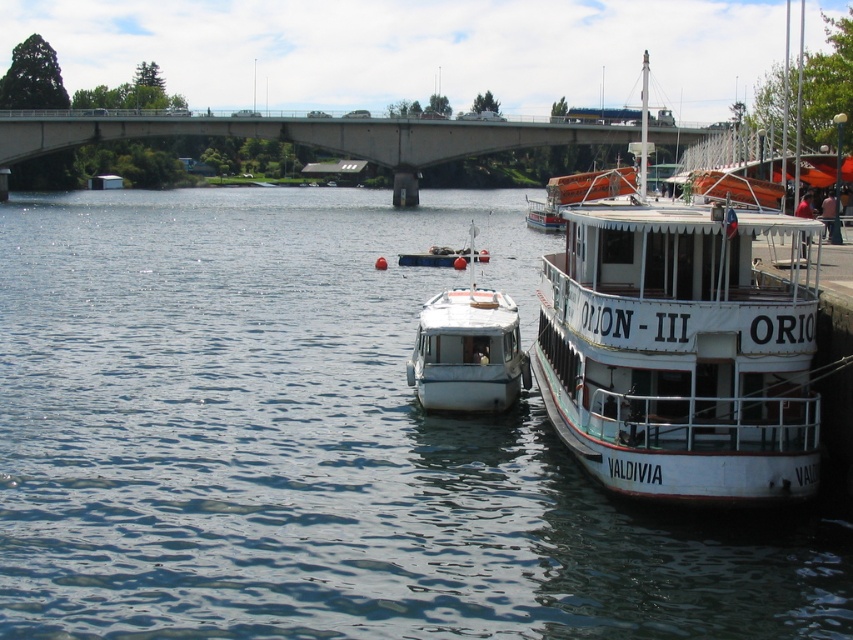
Does point (403, 204) lie behind point (463, 323)?

Yes, it is.

Is concrete bridge at upper center closer to the viewer compared to white glossy boat at center?

No, concrete bridge at upper center is further to the viewer.

Which is behind, point (432, 161) or point (477, 333)?

The point (432, 161) is more distant.

This screenshot has height=640, width=853. In order to click on concrete bridge at upper center in this screenshot , I will do `click(305, 134)`.

Can you confirm if white wooden boat at right is positioned below concrete bridge at upper center?

Yes, white wooden boat at right is below concrete bridge at upper center.

Is the position of white wooden boat at right more distant than that of concrete bridge at upper center?

No, white wooden boat at right is closer to the viewer.

Is point (595, 324) in front of point (457, 134)?

Yes, point (595, 324) is in front of point (457, 134).

You are a GUI agent. You are given a task and a screenshot of the screen. Output one action in this format:
    pyautogui.click(x=<x>, y=<y>)
    Task: Click on the white wooden boat at right
    This screenshot has height=640, width=853.
    Given the screenshot: What is the action you would take?
    pyautogui.click(x=682, y=348)

Does concrete bridge at upper center appear on the left side of orange rubber lifeboat at upper right?

Indeed, concrete bridge at upper center is positioned on the left side of orange rubber lifeboat at upper right.

Is point (148, 122) closer to camera compared to point (544, 186)?

Yes.

Find the location of a particular element. This screenshot has height=640, width=853. concrete bridge at upper center is located at coordinates (305, 134).